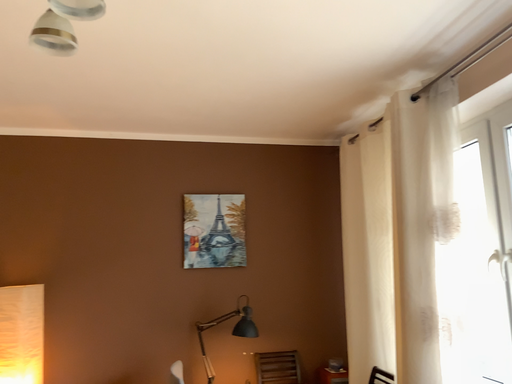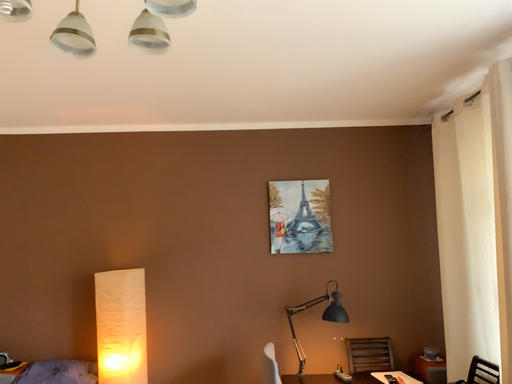
Question: Which way did the camera rotate in the video?

Choices:
 (A) rotated right
 (B) rotated left

Answer: (B)